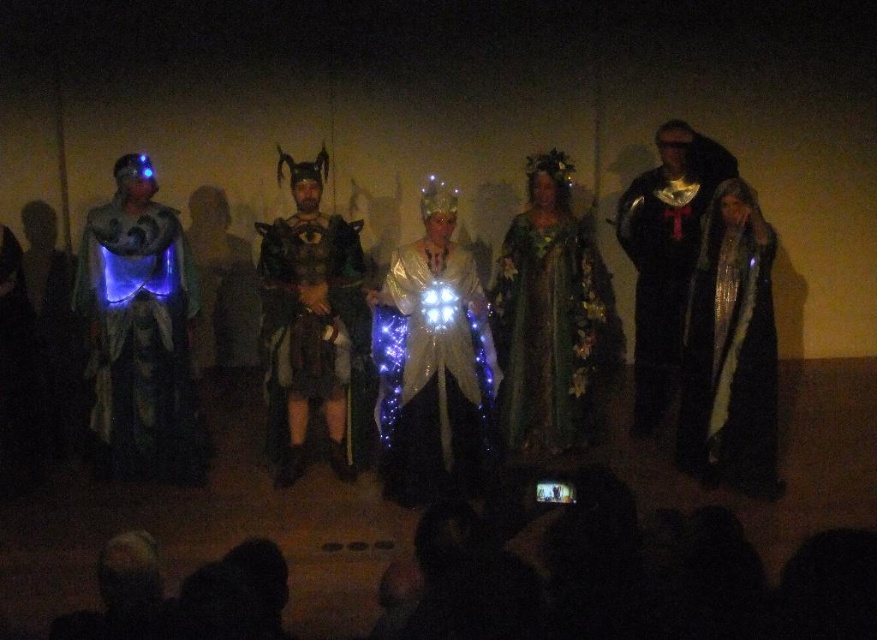
You are a photographer at the back of the venue. You want to take a photo of the metallic armor at center and the green floral dress at center such that both are clearly visible. Considering their sizes, which object should you focus on first to ensure proper exposure?

The metallic armor at center is larger than the green floral dress at center, so you should focus on the metallic armor at center first to ensure proper exposure.

You are a photographer standing at the camera position. You want to capture a closeup shot of the metallic armor at center. Given that your camera has a maximum zoom range of 10 feet, can you get a clear closeup without moving closer? Please explain your reasoning.

The metallic armor at center and camera are 13.73 feet apart from each other. Since the maximum zoom range is 10 feet, the distance is greater than the camera can handle, so you cannot get a clear closeup without moving closer.

You are an audience member holding a phone and trying to take a clear photo of both the shiny silver robe at right and the black velvet cape at center. Since the stage is dimly lit, you need to adjust your phone settings. Which object should you focus on first to ensure both are in focus?

You should focus on the shiny silver robe at right first because it is closer to you than the black velvet cape at center. By focusing on the closer object, the farther one may still be in focus due to the depth of field, ensuring both are sharp in the photo.